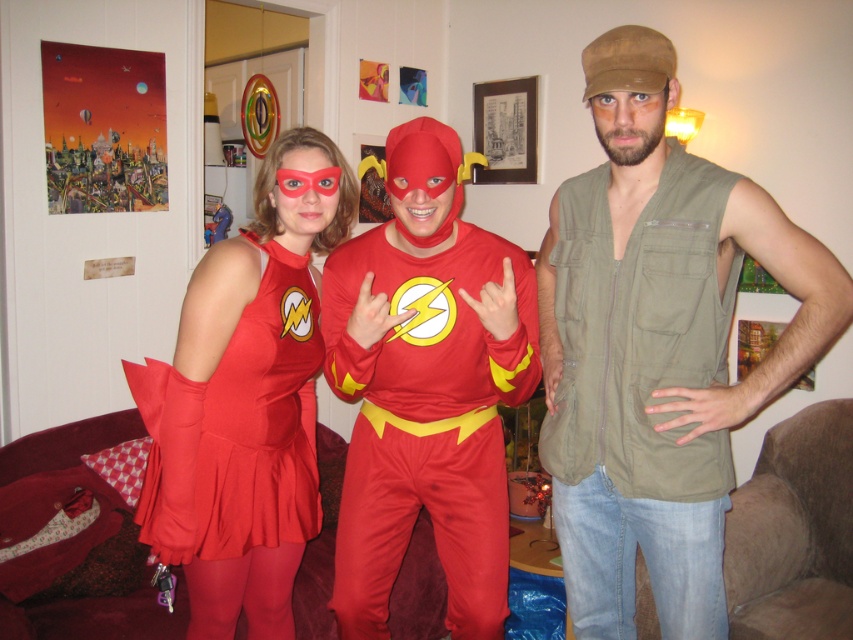
Question: Can you confirm if shiny spandex suit at center is bigger than matte red costume at upper left?

Choices:
 (A) yes
 (B) no

Answer: (A)

Question: Is olive green sleeveless vest at center to the right of matte red dress at center from the viewer's perspective?

Choices:
 (A) yes
 (B) no

Answer: (A)

Question: Considering the real-world distances, which object is closest to the matte red dress at center?

Choices:
 (A) shiny spandex suit at center
 (B) matte red costume at upper left

Answer: (A)

Question: Estimate the real-world distances between objects in this image. Which object is closer to the shiny spandex suit at center?

Choices:
 (A) olive green sleeveless vest at center
 (B) matte red dress at center

Answer: (B)

Question: Which of the following is the farthest from the observer?

Choices:
 (A) matte red costume at upper left
 (B) olive green sleeveless vest at center
 (C) shiny spandex suit at center
 (D) matte red dress at center

Answer: (A)

Question: Is olive green sleeveless vest at center to the left of shiny spandex suit at center from the viewer's perspective?

Choices:
 (A) no
 (B) yes

Answer: (A)